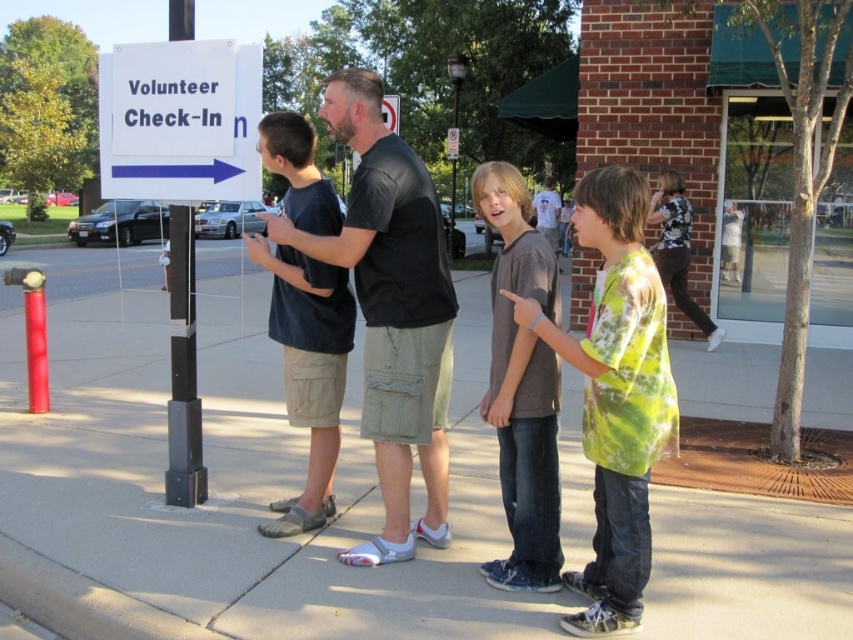
Is gray concrete sidewalk at center bigger than black leather shirt at center?

Yes, gray concrete sidewalk at center is bigger than black leather shirt at center.

Between gray concrete sidewalk at center and black leather shirt at center, which one appears on the right side from the viewer's perspective?

black leather shirt at center

What do you see at coordinates (235, 470) in the screenshot? I see `gray concrete sidewalk at center` at bounding box center [235, 470].

This screenshot has height=640, width=853. I want to click on gray concrete sidewalk at center, so click(x=235, y=470).

This screenshot has height=640, width=853. Identify the location of black leather shirt at center. (392, 310).

Is point (436, 388) positioned after point (329, 266)?

No.

Find the location of `black leather shirt at center`. black leather shirt at center is located at coordinates (392, 310).

Who is more forward, (618, 593) or (492, 273)?

Point (618, 593) is in front.

Where is `green tie-dye shirt at center`? The width and height of the screenshot is (853, 640). green tie-dye shirt at center is located at coordinates (616, 394).